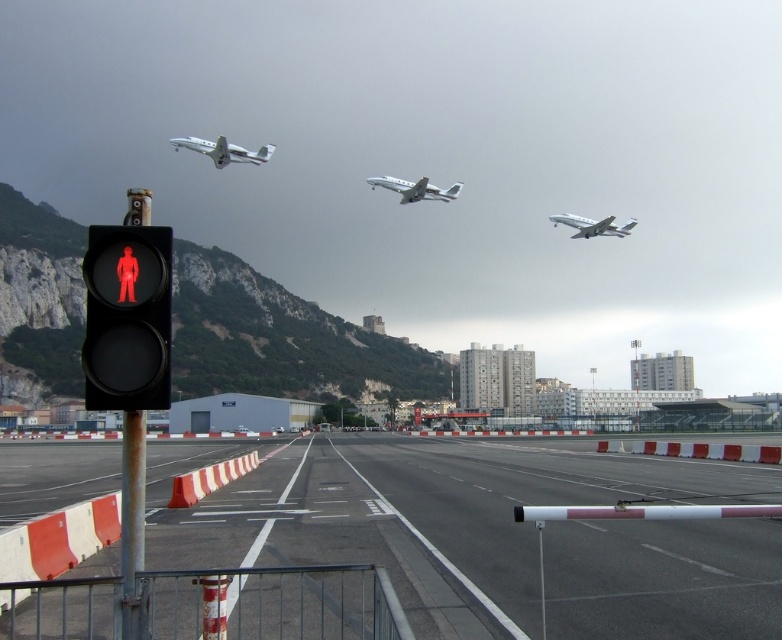
Can you confirm if black matte pedestrian signal at left is shorter than metallic silver airplane at center?

Correct, black matte pedestrian signal at left is not as tall as metallic silver airplane at center.

Does point (88, 321) come farther from viewer compared to point (414, 196)?

No, it is not.

The width and height of the screenshot is (782, 640). What are the coordinates of `black matte pedestrian signal at left` in the screenshot? It's located at (127, 317).

From the picture: Does black asphalt runway at center have a greater width compared to metallic silver airplane at center?

Indeed, black asphalt runway at center has a greater width compared to metallic silver airplane at center.

Does black asphalt runway at center appear on the right side of metallic silver airplane at center?

Indeed, black asphalt runway at center is positioned on the right side of metallic silver airplane at center.

Is point (736, 588) in front of point (454, 195)?

Yes, point (736, 588) is closer to viewer.

The image size is (782, 640). I want to click on black asphalt runway at center, so click(x=429, y=516).

Between metallic pole at left and metallic silver airplane at upper center, which one is positioned higher?

metallic silver airplane at upper center is above.

Is point (138, 611) farther from camera compared to point (561, 220)?

No, it is in front of (561, 220).

Locate an element on the screen. metallic pole at left is located at coordinates (131, 516).